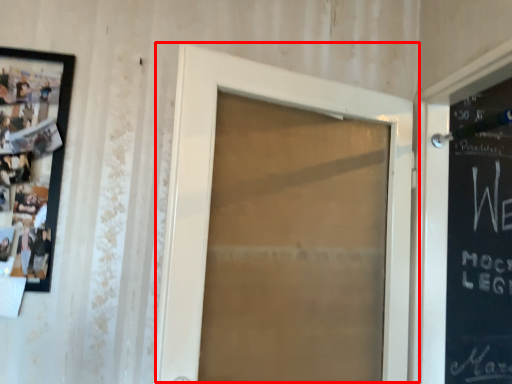
Question: Observing the image, what is the correct spatial positioning of door (annotated by the red box) in reference to picture frame?

Choices:
 (A) right
 (B) left

Answer: (A)